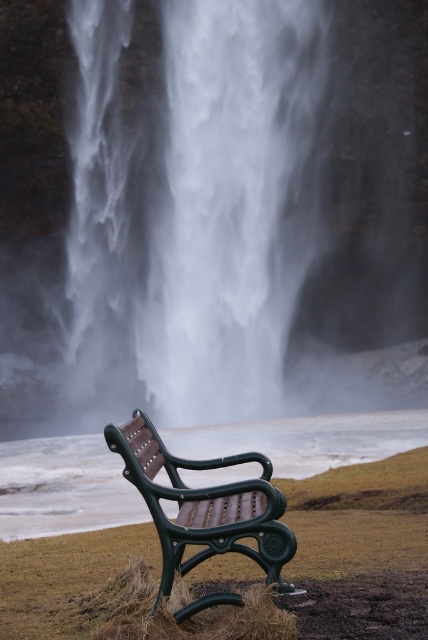
Is translucent mist at bench center thinner than green plastic bench at lower center?

No, translucent mist at bench center is not thinner than green plastic bench at lower center.

Does translucent mist at bench center have a greater height compared to green plastic bench at lower center?

Yes, translucent mist at bench center is taller than green plastic bench at lower center.

Find the location of a particular element. The height and width of the screenshot is (640, 428). translucent mist at bench center is located at coordinates (64, 486).

Does point (101, 12) lie behind point (166, 572)?

Yes, it is behind point (166, 572).

Is point (213, 90) closer to viewer compared to point (240, 497)?

No, it is behind (240, 497).

Where is `white misty waterfall at center`? The width and height of the screenshot is (428, 640). white misty waterfall at center is located at coordinates (193, 208).

Does white misty waterfall at center have a lesser width compared to translucent mist at bench center?

Yes, white misty waterfall at center is thinner than translucent mist at bench center.

Does point (139, 288) come behind point (296, 435)?

Yes.

In order to click on white misty waterfall at center in this screenshot , I will do `click(193, 208)`.